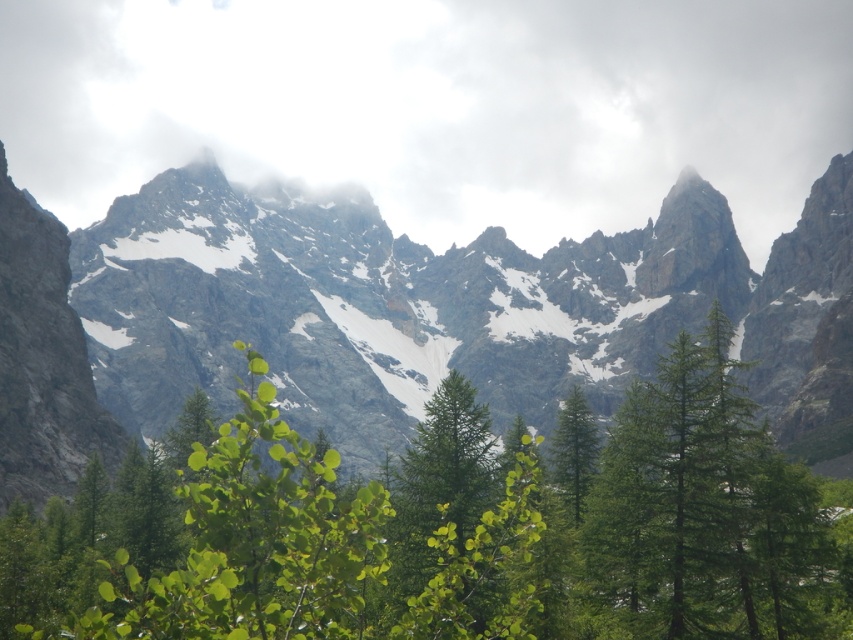
From the picture: Can you confirm if green leafy tree at center is thinner than green matte tree at center?

No, green leafy tree at center is not thinner than green matte tree at center.

Between green leafy tree at center and green matte tree at center, which one is positioned lower?

green leafy tree at center is lower down.

Does point (485, 566) lie behind point (561, 448)?

No, it is in front of (561, 448).

The width and height of the screenshot is (853, 640). Identify the location of green leafy tree at center. (451, 529).

Does white fluffy cloud at upper center appear on the left side of green matte tree at center?

Yes, white fluffy cloud at upper center is to the left of green matte tree at center.

Between point (97, 97) and point (577, 516), which one is positioned behind?

The point (97, 97) is behind.

Locate an element on the screen. The image size is (853, 640). white fluffy cloud at upper center is located at coordinates pos(434,106).

Does white fluffy cloud at upper center appear on the left side of rocky gray mountain range at center?

No, white fluffy cloud at upper center is not to the left of rocky gray mountain range at center.

Is white fluffy cloud at upper center closer to the viewer compared to rocky gray mountain range at center?

That is False.

From the picture: Who is more distant from viewer, (x=239, y=108) or (x=850, y=346)?

Positioned behind is point (x=239, y=108).

At what (x,y) coordinates should I click in order to perform the action: click on white fluffy cloud at upper center. Please return your answer as a coordinate pair (x, y). The height and width of the screenshot is (640, 853). Looking at the image, I should click on (434, 106).